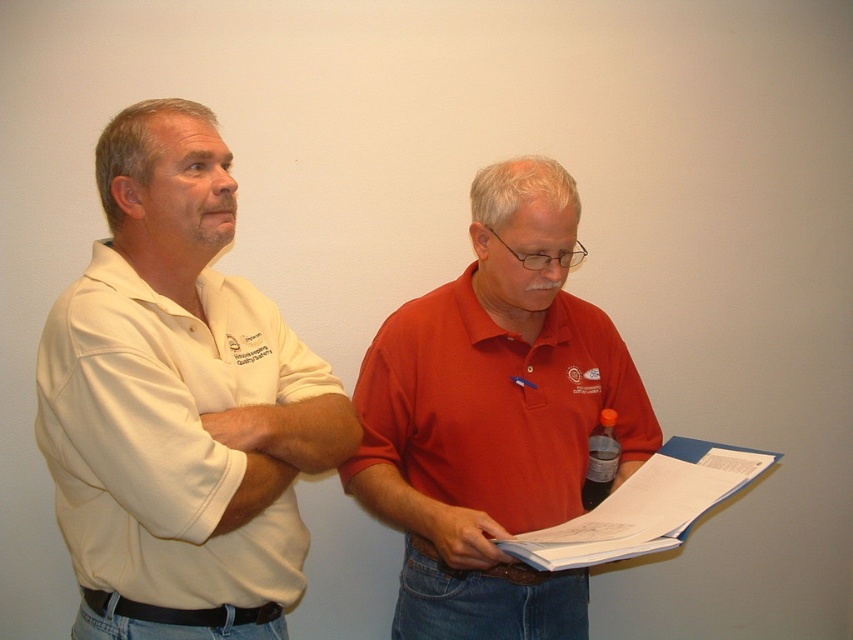
Looking at this image, between matte red polo shirt at center and matte red shirt at center, which one appears on the right side from the viewer's perspective?

matte red polo shirt at center is more to the right.

Does matte red polo shirt at center appear under matte red shirt at center?

No.

Between point (515, 577) and point (363, 422), which one is positioned behind?

The point (363, 422) is more distant.

Identify the location of matte red polo shirt at center. (494, 417).

Is white cotton shirt at left to the left of matte red polo shirt at center from the viewer's perspective?

Correct, you'll find white cotton shirt at left to the left of matte red polo shirt at center.

Locate an element on the screen. white cotton shirt at left is located at coordinates (178, 403).

Does point (274, 524) come behind point (408, 458)?

No, (274, 524) is closer to viewer.

You are a GUI agent. You are given a task and a screenshot of the screen. Output one action in this format:
    pyautogui.click(x=<x>, y=<y>)
    Task: Click on the white cotton shirt at left
    The height and width of the screenshot is (640, 853).
    Given the screenshot: What is the action you would take?
    pyautogui.click(x=178, y=403)

Does white cotton shirt at left have a lesser width compared to matte red shirt at center?

Incorrect, white cotton shirt at left's width is not less than matte red shirt at center's.

Who is positioned more to the left, white cotton shirt at left or matte red shirt at center?

Positioned to the left is white cotton shirt at left.

What do you see at coordinates (178, 403) in the screenshot?
I see `white cotton shirt at left` at bounding box center [178, 403].

I want to click on white cotton shirt at left, so click(x=178, y=403).